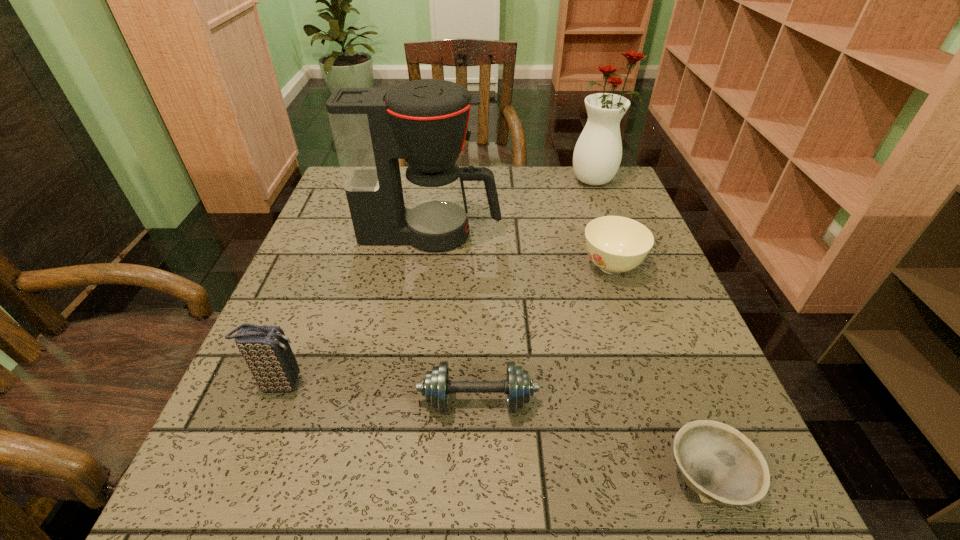
Identify the location of vacant space situated 0.380m with the zip open on the fourth shortest object. (523, 383).

You are a GUI agent. You are given a task and a screenshot of the screen. Output one action in this format:
    pyautogui.click(x=<x>, y=<y>)
    Task: Click on the blank space located on the front of the sugar bowl
    This screenshot has width=960, height=540.
    Given the screenshot: What is the action you would take?
    pyautogui.click(x=649, y=378)

Locate an element on the screen. This screenshot has width=960, height=540. vacant space situated 0.100m on the front of the dumbbell is located at coordinates (477, 487).

This screenshot has height=540, width=960. Find the location of `vacant point located on the left of the bowl`. vacant point located on the left of the bowl is located at coordinates (405, 478).

Where is `object present at the far edge`? object present at the far edge is located at coordinates (597, 155).

I want to click on object positioned at the near edge, so click(x=721, y=465).

This screenshot has height=540, width=960. Find the location of `coffee maker present at the left edge`. coffee maker present at the left edge is located at coordinates (425, 122).

The width and height of the screenshot is (960, 540). Identify the location of clutch bag located in the left edge section of the desktop. (265, 349).

Identify the location of vase at the right edge. The width and height of the screenshot is (960, 540). (597, 155).

Locate an element on the screen. sugar bowl at the right edge is located at coordinates (616, 244).